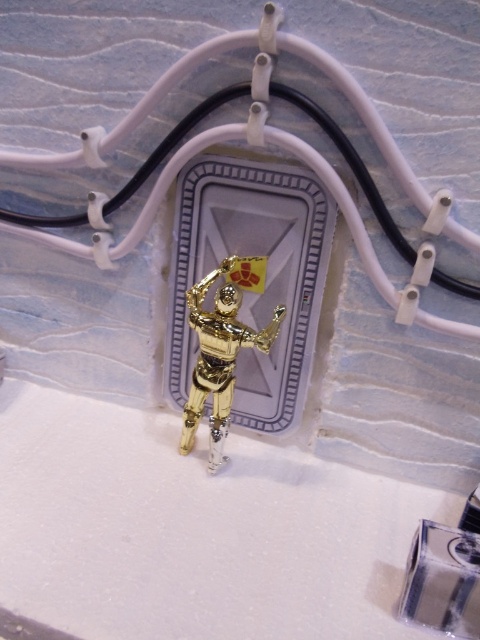
Who is shorter, black rubber wire at center or gold metallic robot at center?

gold metallic robot at center is shorter.

Is the position of black rubber wire at center less distant than that of gold metallic robot at center?

Yes, it is.

Which is in front, point (420, 195) or point (231, 352)?

Positioned in front is point (420, 195).

Where is `black rubber wire at center`? black rubber wire at center is located at coordinates coord(133,108).